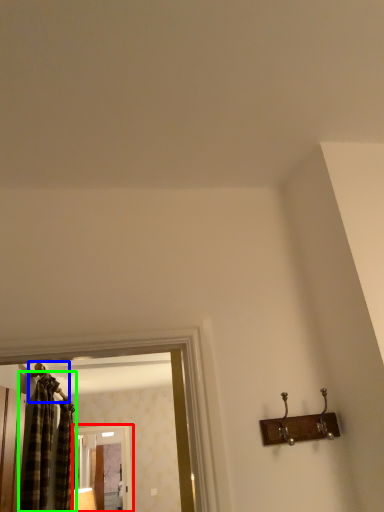
Question: Considering the real-world distances, which object is closest to screen door (highlighted by a red box)? hanger (highlighted by a blue box) or curtain (highlighted by a green box).

Choices:
 (A) hanger
 (B) curtain

Answer: (B)